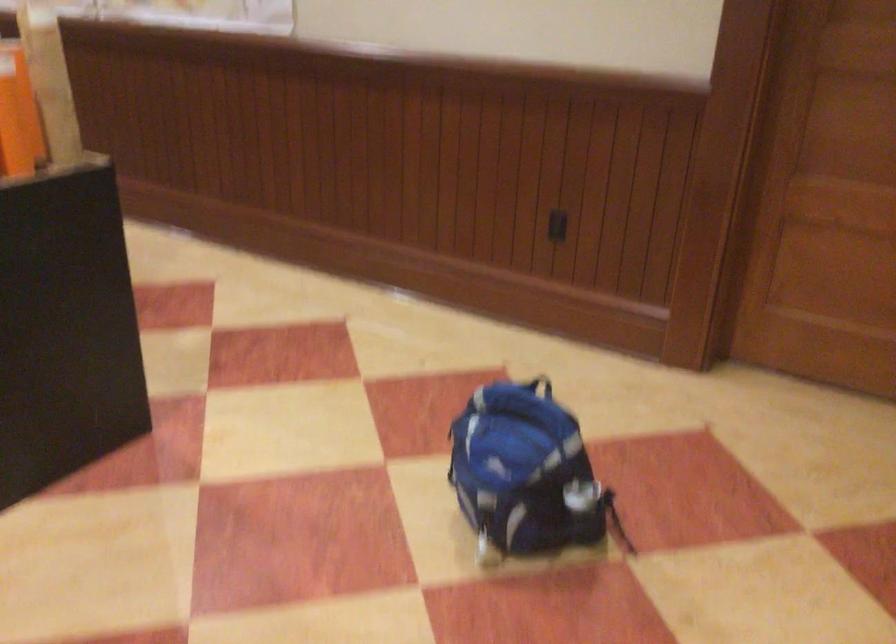
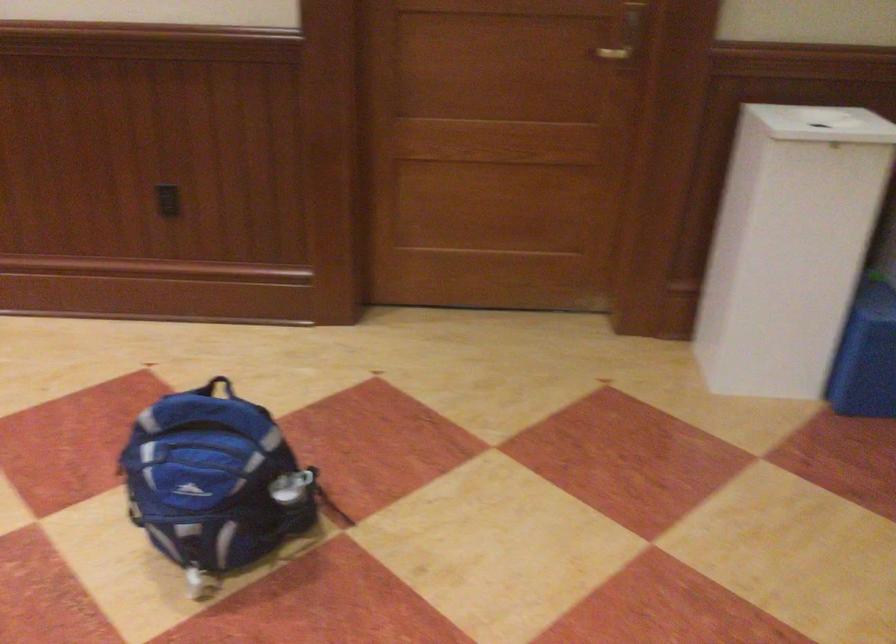
Find the pixel in the second image that matches point (533, 392) in the first image.

(217, 386)